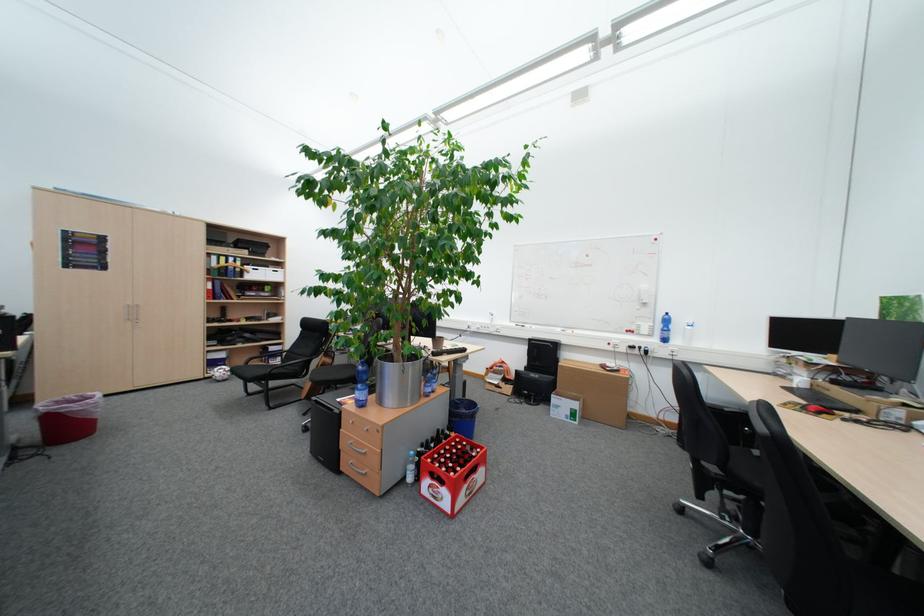
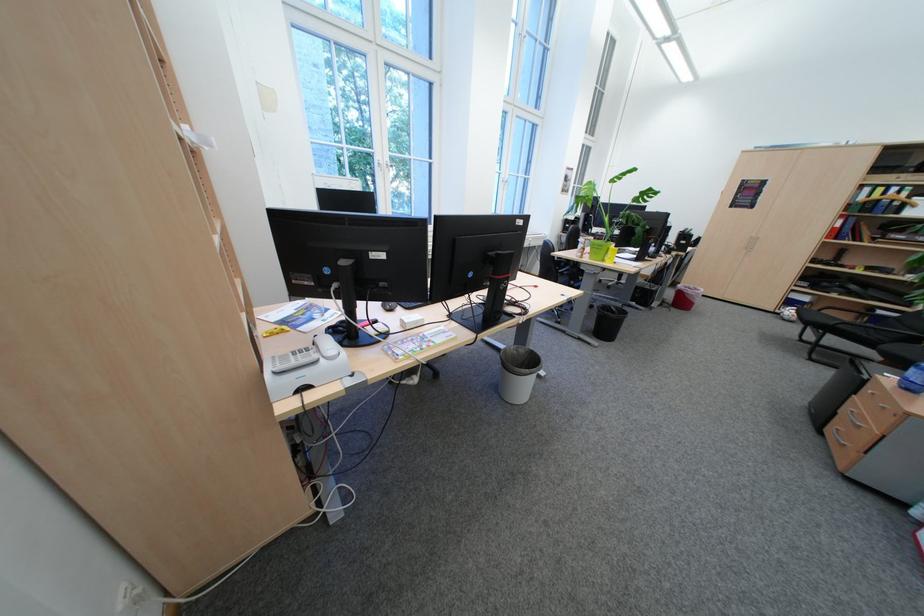
In the second image, find the point that corresponds to (369,402) in the first image.

(917, 381)